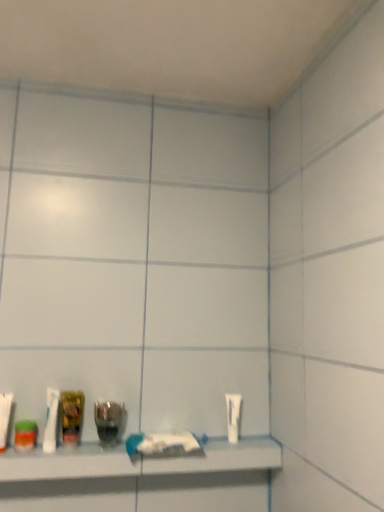
Question: From the image's perspective, does white plastic toothbrush at lower left, acting as the second toiletry starting from the right, appear higher than translucent plastic mouthwash at lower left, placed as the first mouthwash when sorted from left to right?

Choices:
 (A) no
 (B) yes

Answer: (B)

Question: From the image's perspective, would you say white plastic toothbrush at lower left, which is the 1th toiletry from front to back, is shown under translucent plastic mouthwash at lower left, placed as the first mouthwash when sorted from left to right?

Choices:
 (A) yes
 (B) no

Answer: (B)

Question: Does white plastic toothbrush at lower left, which is the 1th toiletry from front to back, have a smaller size compared to translucent plastic mouthwash at lower left, marked as the third mouthwash in a right-to-left arrangement?

Choices:
 (A) no
 (B) yes

Answer: (A)

Question: Can you confirm if white plastic toothbrush at lower left, which appears as the first toiletry when viewed from the left, is taller than translucent plastic mouthwash at lower left, marked as the third mouthwash in a right-to-left arrangement?

Choices:
 (A) yes
 (B) no

Answer: (A)

Question: Is white plastic toothbrush at lower left, which appears as the first toiletry when viewed from the left, positioned far away from translucent plastic mouthwash at lower left, marked as the third mouthwash in a right-to-left arrangement?

Choices:
 (A) no
 (B) yes

Answer: (A)

Question: Is white plastic toothbrush at lower left, acting as the second toiletry starting from the right, at the right side of translucent plastic mouthwash at lower left, placed as the first mouthwash when sorted from left to right?

Choices:
 (A) yes
 (B) no

Answer: (B)

Question: Is the position of clear plastic bottle at lower center, which is the 1th mouthwash in right-to-left order, more distant than that of white matte tube at right, marked as the 1th toiletry in a right-to-left arrangement?

Choices:
 (A) yes
 (B) no

Answer: (B)

Question: Is clear plastic bottle at lower center, which is the 1th mouthwash in right-to-left order, taller than white matte tube at right, the second toiletry in the left-to-right sequence?

Choices:
 (A) yes
 (B) no

Answer: (B)

Question: Is clear plastic bottle at lower center, the third mouthwash when ordered from left to right, looking in the opposite direction of white matte tube at right, the second toiletry in the left-to-right sequence?

Choices:
 (A) yes
 (B) no

Answer: (B)

Question: From the image's perspective, is clear plastic bottle at lower center, which is the 1th mouthwash in right-to-left order, below white matte tube at right, marked as the 1th toiletry in a right-to-left arrangement?

Choices:
 (A) no
 (B) yes

Answer: (A)

Question: From a real-world perspective, is clear plastic bottle at lower center, which is the 1th mouthwash in right-to-left order, on white matte tube at right, marked as the 1th toiletry in a right-to-left arrangement?

Choices:
 (A) no
 (B) yes

Answer: (A)

Question: Is clear plastic bottle at lower center, the third mouthwash when ordered from left to right, thinner than white matte tube at right, which ranks as the 1th toiletry in back-to-front order?

Choices:
 (A) yes
 (B) no

Answer: (B)

Question: Are white matte tube at right, marked as the 1th toiletry in a right-to-left arrangement, and white plastic toothbrush at lower left, which is the 1th toiletry from front to back, far apart?

Choices:
 (A) no
 (B) yes

Answer: (A)